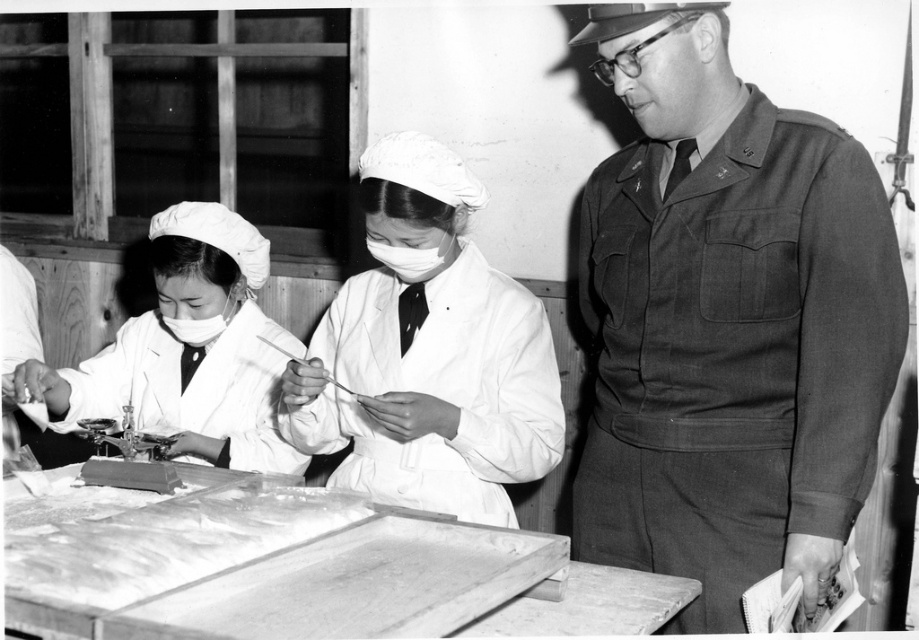
Question: Which point is farther from the camera taking this photo?

Choices:
 (A) (382, 528)
 (B) (322, 362)
 (C) (698, 129)
 (D) (446, 248)

Answer: (D)

Question: Considering the real-world distances, which object is closest to the wooden tray at lower center?

Choices:
 (A) white matte uniform at center
 (B) white matte mask at center

Answer: (A)

Question: Is uniformed man at right thinner than wooden tray at lower center?

Choices:
 (A) no
 (B) yes

Answer: (B)

Question: Which of the following is the farthest from the observer?

Choices:
 (A) (422, 280)
 (B) (548, 403)
 (C) (179, 400)
 (D) (212, 332)

Answer: (C)

Question: Is uniformed man at right below matte white mask at left?

Choices:
 (A) no
 (B) yes

Answer: (A)

Question: Does white matte uniform at center appear on the left side of white matte lab coat at center?

Choices:
 (A) yes
 (B) no

Answer: (B)